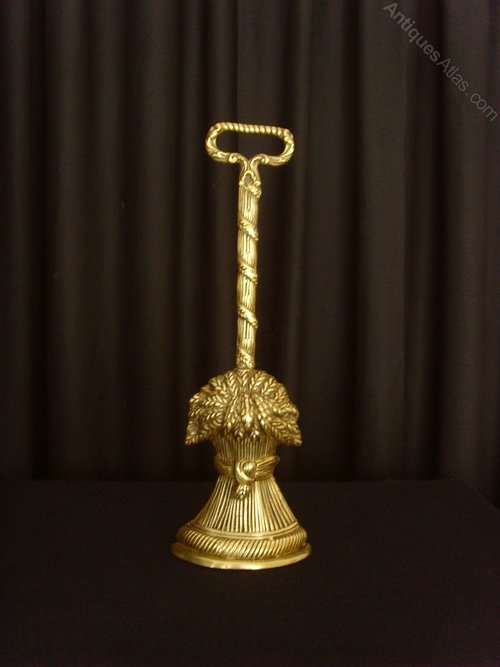
Where is `brown curtains`? brown curtains is located at coordinates (380, 263).